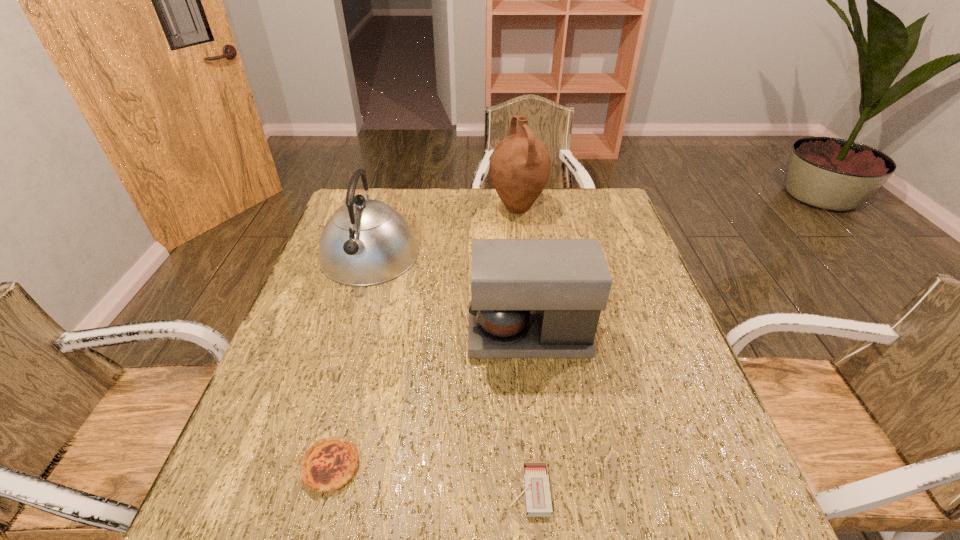
Identify the location of the farthest object. The image size is (960, 540). (520, 165).

This screenshot has width=960, height=540. What are the coordinates of `pitcher` in the screenshot? It's located at (520, 165).

Locate an element on the screen. The height and width of the screenshot is (540, 960). kettle is located at coordinates (365, 242).

The height and width of the screenshot is (540, 960). What are the coordinates of `the third farthest object` in the screenshot? It's located at (530, 298).

I want to click on matchbox, so (538, 503).

Where is `quiche`? This screenshot has width=960, height=540. quiche is located at coordinates (328, 465).

The height and width of the screenshot is (540, 960). What are the coordinates of `vacant space situated 0.190m on the front of the farthest object` in the screenshot? It's located at (524, 262).

Locate an element on the screen. The height and width of the screenshot is (540, 960). free space located from the spout of the kettle is located at coordinates (343, 345).

I want to click on free space located on the carafe side of the third farthest object, so click(x=322, y=335).

You are a GUI agent. You are given a task and a screenshot of the screen. Output one action in this format:
    pyautogui.click(x=<x>, y=<y>)
    Task: Click on the free location located 0.150m on the carafe side of the third farthest object
    This screenshot has width=960, height=540.
    Given the screenshot: What is the action you would take?
    pyautogui.click(x=405, y=335)